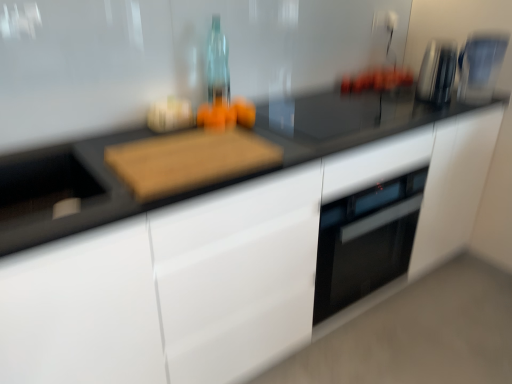
Question: From their relative heights in the image, would you say sleek metallic coffee machine at upper right is taller or shorter than orange matte oranges at center?

Choices:
 (A) tall
 (B) short

Answer: (A)

Question: Considering the positions of sleek metallic coffee machine at upper right and orange matte oranges at center in the image, is sleek metallic coffee machine at upper right wider or thinner than orange matte oranges at center?

Choices:
 (A) wide
 (B) thin

Answer: (A)

Question: Estimate the real-world distances between objects in this image. Which object is farther from the orange matte oranges at center?

Choices:
 (A) wooden cutting board at center
 (B) satin silver toaster at upper right
 (C) sleek metallic coffee machine at upper right

Answer: (C)

Question: Considering the real-world distances, which object is farthest from the sleek metallic coffee machine at upper right?

Choices:
 (A) satin silver toaster at upper right
 (B) wooden cutting board at center
 (C) orange matte oranges at center

Answer: (B)